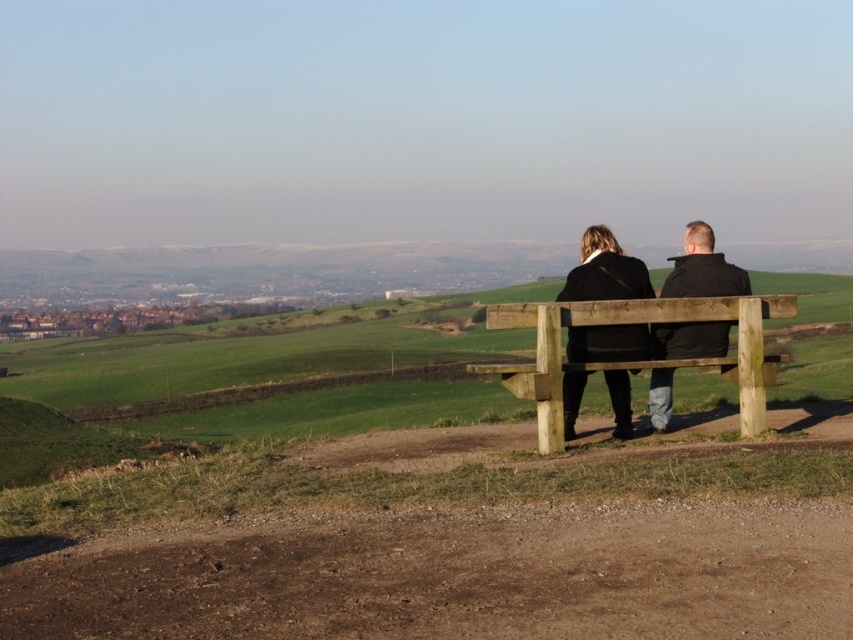
Can you confirm if wooden bench at center is positioned above black matte coat at center?

Correct, wooden bench at center is located above black matte coat at center.

Locate an element on the screen. The height and width of the screenshot is (640, 853). wooden bench at center is located at coordinates (635, 360).

Is the position of black matte coat at center more distant than that of black leather jacket at center?

No, black matte coat at center is in front of black leather jacket at center.

Is black matte coat at center below black leather jacket at center?

Yes, black matte coat at center is below black leather jacket at center.

Between point (593, 268) and point (692, 326), which one is positioned in front?

Point (593, 268) is more forward.

Find the location of a particular element. black matte coat at center is located at coordinates (605, 272).

Does wooden bench at center have a greater width compared to black leather jacket at center?

Correct, the width of wooden bench at center exceeds that of black leather jacket at center.

Is point (764, 401) farther from viewer compared to point (669, 384)?

No, it is in front of (669, 384).

Between point (679, 317) and point (691, 248), which one is positioned in front?

Point (679, 317) is more forward.

The image size is (853, 640). Find the location of `wooden bench at center`. wooden bench at center is located at coordinates (635, 360).